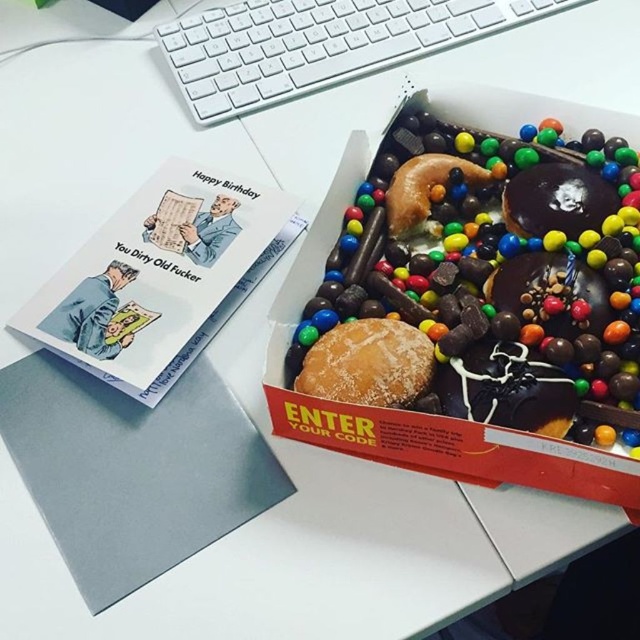
Does multicolored chocolate-coated candies at center appear over powdered sugar bun at center?

Yes, multicolored chocolate-coated candies at center is above powdered sugar bun at center.

Between multicolored chocolate-coated candies at center and powdered sugar bun at center, which one has more height?

multicolored chocolate-coated candies at center

Find the location of a particular element. The width and height of the screenshot is (640, 640). multicolored chocolate-coated candies at center is located at coordinates (502, 276).

Can you confirm if multicolored chocolate-coated candies at center is bigger than white plastic keyboard at upper center?

Yes.

Does multicolored chocolate-coated candies at center come in front of white plastic keyboard at upper center?

Yes, it is.

The width and height of the screenshot is (640, 640). I want to click on multicolored chocolate-coated candies at center, so click(502, 276).

Does point (509, 16) lie in front of point (429, 346)?

No, it is not.

Who is higher up, white plastic keyboard at upper center or powdered sugar bun at center?

Positioned higher is white plastic keyboard at upper center.

At what (x,y) coordinates should I click in order to perform the action: click on white plastic keyboard at upper center. Please return your answer as a coordinate pair (x, y). The width and height of the screenshot is (640, 640). Looking at the image, I should click on pos(317,44).

This screenshot has height=640, width=640. Identify the location of white plastic keyboard at upper center. (317, 44).